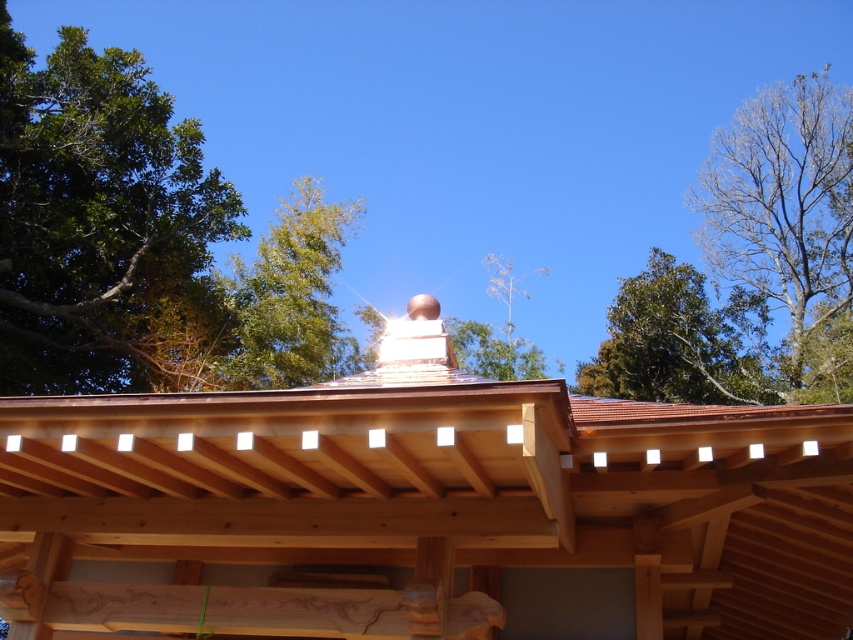
Question: Can you confirm if green leafy tree at upper left is positioned to the left of bare branches at upper right?

Choices:
 (A) no
 (B) yes

Answer: (B)

Question: Can you confirm if shiny copper roof at center is wider than green leafy tree at upper right?

Choices:
 (A) no
 (B) yes

Answer: (A)

Question: Is shiny copper roof at center to the left of green leafy tree at upper center from the viewer's perspective?

Choices:
 (A) yes
 (B) no

Answer: (B)

Question: Which object appears farthest from the camera in this image?

Choices:
 (A) shiny copper roof at center
 (B) bare branches at upper right

Answer: (B)

Question: Which object is the farthest from the shiny copper roof at center?

Choices:
 (A) green leafy tree at upper right
 (B) green leafy tree at upper center

Answer: (A)

Question: Which point is farther from the camera taking this photo?

Choices:
 (A) (x=633, y=394)
 (B) (x=36, y=360)
 (C) (x=793, y=96)
 (D) (x=227, y=317)

Answer: (C)